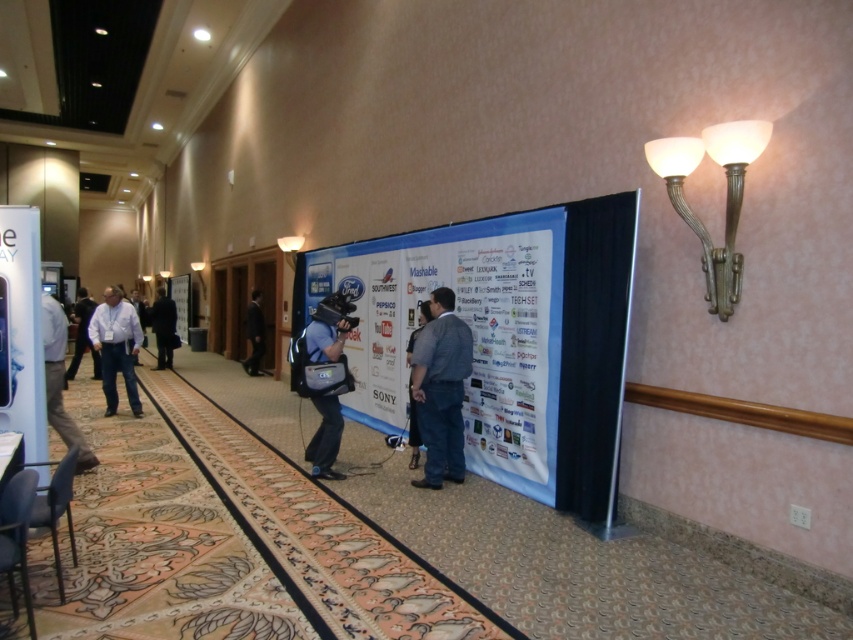
You are a photographer positioned at the entrance of the hallway. You need to capture a clear photo of both the dark gray suit at center and the dark blue suit at center. Which suit should you focus on first to ensure both are in focus?

The dark gray suit at center is closer to the viewer than the dark blue suit at center. To ensure both are in focus, you should focus on the dark gray suit at center first, as it is closer, and adjust the depth of field to include the dark blue suit at center in the background.

You are a photographer in a conference hallway and need to position yourself between the dark gray suit at center and the blue fabric camera at center. Which object should you stand closer to if you want to be nearer to the right wall?

The dark gray suit at center is positioned on the right side of blue fabric camera at center. Therefore, to be nearer to the right wall, you should stand closer to the dark gray suit at center.